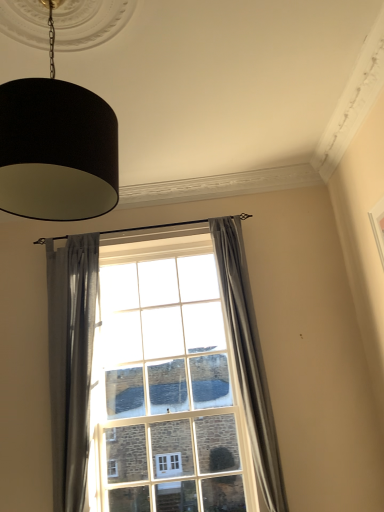
Question: Does black fabric lampshade at upper left have a larger size compared to clear glass window at center?

Choices:
 (A) yes
 (B) no

Answer: (B)

Question: Considering the relative sizes of black fabric lampshade at upper left and clear glass window at center in the image provided, is black fabric lampshade at upper left wider than clear glass window at center?

Choices:
 (A) yes
 (B) no

Answer: (A)

Question: Is black fabric lampshade at upper left not near clear glass window at center?

Choices:
 (A) yes
 (B) no

Answer: (A)

Question: From the image's perspective, is black fabric lampshade at upper left below clear glass window at center?

Choices:
 (A) yes
 (B) no

Answer: (B)

Question: From the image's perspective, is black fabric lampshade at upper left above clear glass window at center?

Choices:
 (A) yes
 (B) no

Answer: (A)

Question: Is black fabric lampshade at upper left to the left of clear glass window at center from the viewer's perspective?

Choices:
 (A) yes
 (B) no

Answer: (A)

Question: Considering the relative sizes of black fabric lampshade at upper left and gray fabric curtain at center, which is the first curtain in right-to-left order, in the image provided, is black fabric lampshade at upper left smaller than gray fabric curtain at center, which is the first curtain in right-to-left order,?

Choices:
 (A) yes
 (B) no

Answer: (B)

Question: Can you confirm if black fabric lampshade at upper left is bigger than gray fabric curtain at center, which is the first curtain in right-to-left order?

Choices:
 (A) yes
 (B) no

Answer: (A)

Question: Are black fabric lampshade at upper left and gray fabric curtain at center, which is the first curtain in right-to-left order, beside each other?

Choices:
 (A) yes
 (B) no

Answer: (B)

Question: Considering the relative positions of black fabric lampshade at upper left and gray fabric curtain at center, which is the first curtain in right-to-left order, in the image provided, is black fabric lampshade at upper left to the right of gray fabric curtain at center, which is the first curtain in right-to-left order, from the viewer's perspective?

Choices:
 (A) no
 (B) yes

Answer: (A)

Question: From the image's perspective, is black fabric lampshade at upper left below gray fabric curtain at center, placed as the second curtain when sorted from left to right?

Choices:
 (A) no
 (B) yes

Answer: (A)

Question: Is black fabric lampshade at upper left turned away from gray fabric curtain at center, placed as the second curtain when sorted from left to right?

Choices:
 (A) yes
 (B) no

Answer: (B)

Question: Is gray fabric curtain at center, which is the first curtain in right-to-left order, at the back of satin gray curtain at left, which is the second curtain in right-to-left order?

Choices:
 (A) no
 (B) yes

Answer: (A)